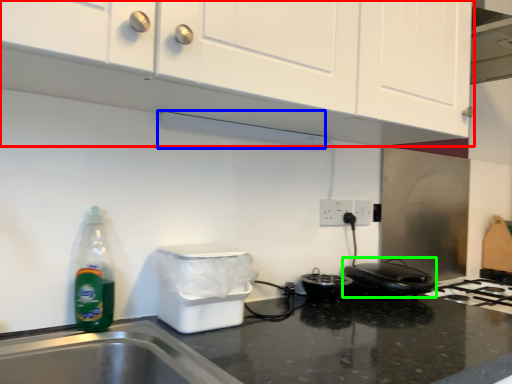
Question: Which object is the farthest from cabinetry (highlighted by a red box)? Choose among these: exhaust hood (highlighted by a blue box) or home appliance (highlighted by a green box).

Choices:
 (A) exhaust hood
 (B) home appliance

Answer: (B)